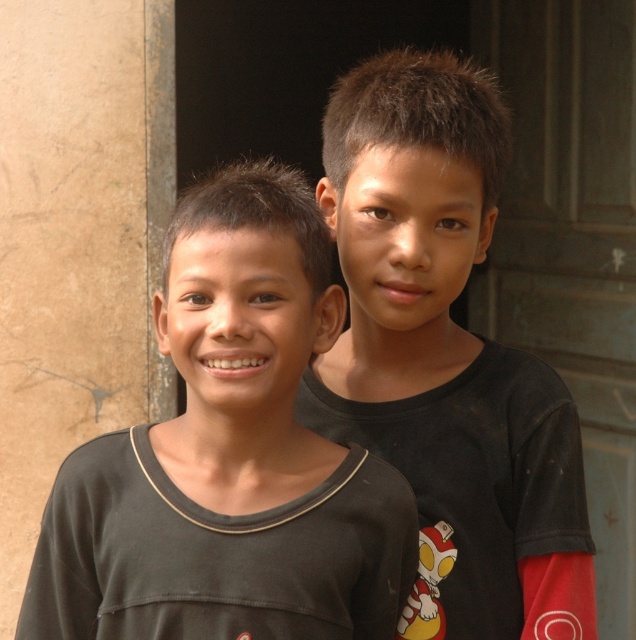
Question: Which object appears closest to the camera in this image?

Choices:
 (A) black matte shirt at center
 (B) dark gray shirt at left

Answer: (B)

Question: Does dark gray shirt at left lie behind black matte shirt at center?

Choices:
 (A) no
 (B) yes

Answer: (A)

Question: Is dark gray shirt at left to the right of black matte shirt at center from the viewer's perspective?

Choices:
 (A) yes
 (B) no

Answer: (B)

Question: Is dark gray shirt at left wider than black matte shirt at center?

Choices:
 (A) yes
 (B) no

Answer: (A)

Question: Which object appears farthest from the camera in this image?

Choices:
 (A) black matte shirt at center
 (B) dark gray shirt at left

Answer: (A)